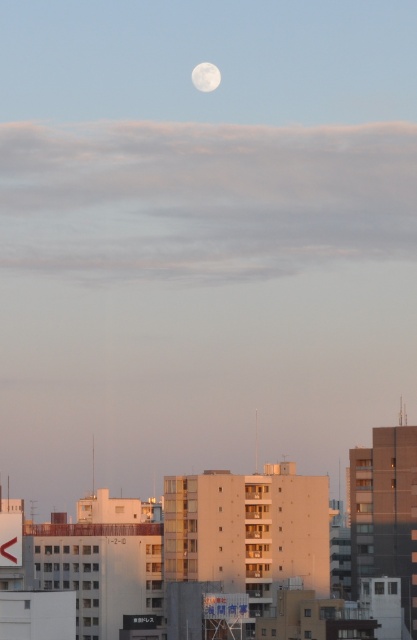
Question: Which point appears farthest from the camera in this image?

Choices:
 (A) (223, 532)
 (B) (208, 92)

Answer: (B)

Question: Is beige concrete building at center to the right of white matte moon at upper center from the viewer's perspective?

Choices:
 (A) no
 (B) yes

Answer: (B)

Question: Which point is farther to the camera?

Choices:
 (A) white matte moon at upper center
 (B) beige concrete building at center

Answer: (A)

Question: Which of the following is the farthest from the observer?

Choices:
 (A) white matte moon at upper center
 (B) beige concrete building at center

Answer: (A)

Question: Can you confirm if beige concrete building at center is wider than white matte moon at upper center?

Choices:
 (A) yes
 (B) no

Answer: (A)

Question: From the image, what is the correct spatial relationship of beige concrete building at center in relation to white matte moon at upper center?

Choices:
 (A) above
 (B) below

Answer: (B)